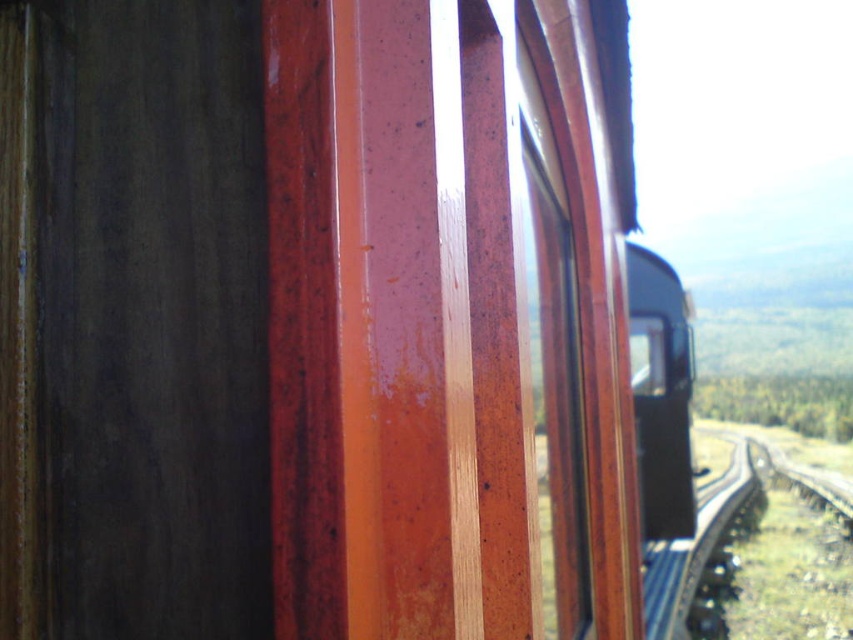
This screenshot has height=640, width=853. I want to click on glossy wood window at upper right, so click(555, 326).

Between glossy wood window at upper right and smooth asphalt train track at right, which one appears on the right side from the viewer's perspective?

Positioned to the right is smooth asphalt train track at right.

Where is `glossy wood window at upper right`? The width and height of the screenshot is (853, 640). glossy wood window at upper right is located at coordinates coord(555,326).

At what (x,y) coordinates should I click in order to perform the action: click on glossy wood window at upper right. Please return your answer as a coordinate pair (x, y). The height and width of the screenshot is (640, 853). Looking at the image, I should click on (555, 326).